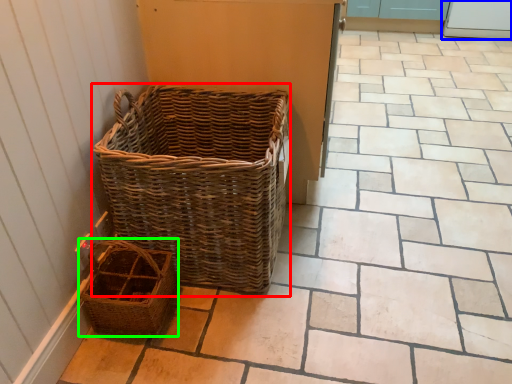
Question: Which object is positioned closest to picnic basket (highlighted by a red box)? Select from screen door (highlighted by a blue box) and picnic basket (highlighted by a green box).

Choices:
 (A) screen door
 (B) picnic basket

Answer: (B)